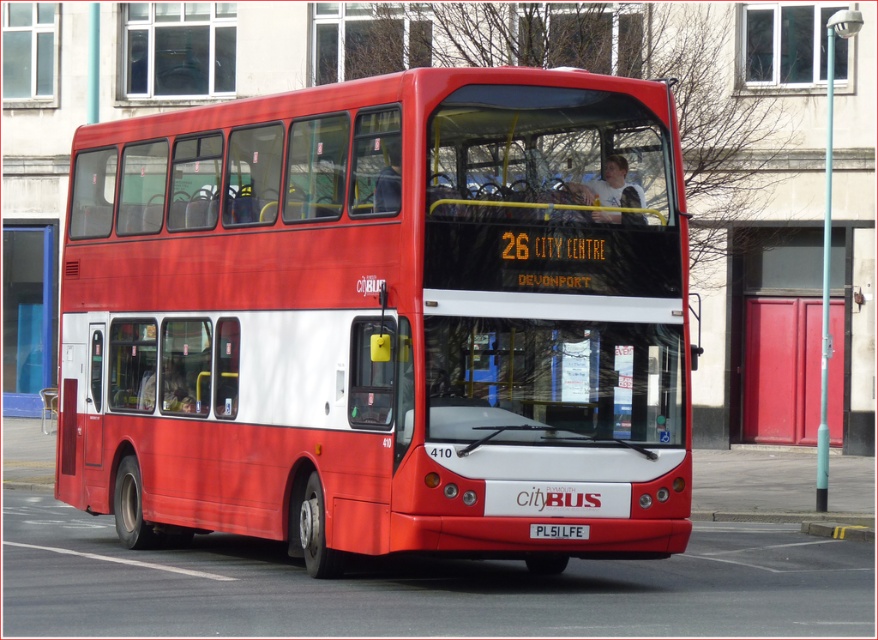
Question: Is matte red bus at center behind white plastic license plate at center?

Choices:
 (A) yes
 (B) no

Answer: (A)

Question: Is matte red bus at center smaller than white plastic license plate at center?

Choices:
 (A) no
 (B) yes

Answer: (A)

Question: Can you confirm if matte red bus at center is smaller than white plastic license plate at center?

Choices:
 (A) yes
 (B) no

Answer: (B)

Question: Which point is closer to the camera?

Choices:
 (A) matte red bus at center
 (B) white plastic license plate at center

Answer: (B)

Question: Which of the following is the closest to the observer?

Choices:
 (A) (559, 525)
 (B) (500, 380)

Answer: (A)